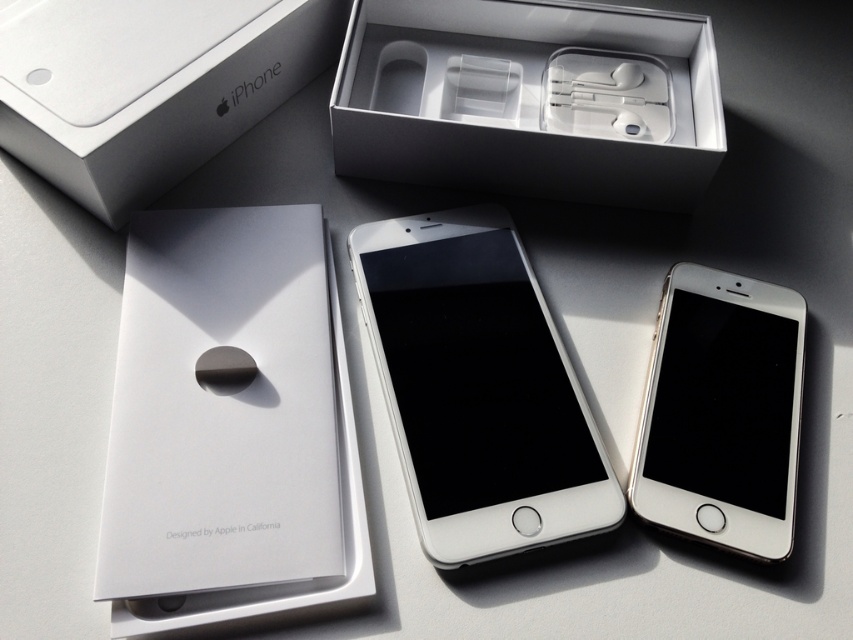
Question: Estimate the real-world distances between objects in this image. Which object is farther from the white matte earphones at center?

Choices:
 (A) sleek silver iphone box at upper left
 (B) silver metallic ipod at center
 (C) silver metallic ipod at lower right

Answer: (C)

Question: Which of the following is the closest to the observer?

Choices:
 (A) sleek silver iphone box at upper left
 (B) silver metallic ipod at center
 (C) white matte earphones at center

Answer: (B)

Question: Which of the following is the farthest from the observer?

Choices:
 (A) (688, 204)
 (B) (463, 451)
 (C) (97, 186)
 (D) (672, 291)

Answer: (A)

Question: Where is white matte earphones at center located in relation to silver metallic ipod at center in the image?

Choices:
 (A) below
 (B) above

Answer: (B)

Question: Where is white matte earphones at center located in relation to silver metallic ipod at center in the image?

Choices:
 (A) left
 (B) right

Answer: (B)

Question: Does white matte earphones at center have a smaller size compared to sleek silver iphone box at upper left?

Choices:
 (A) yes
 (B) no

Answer: (A)